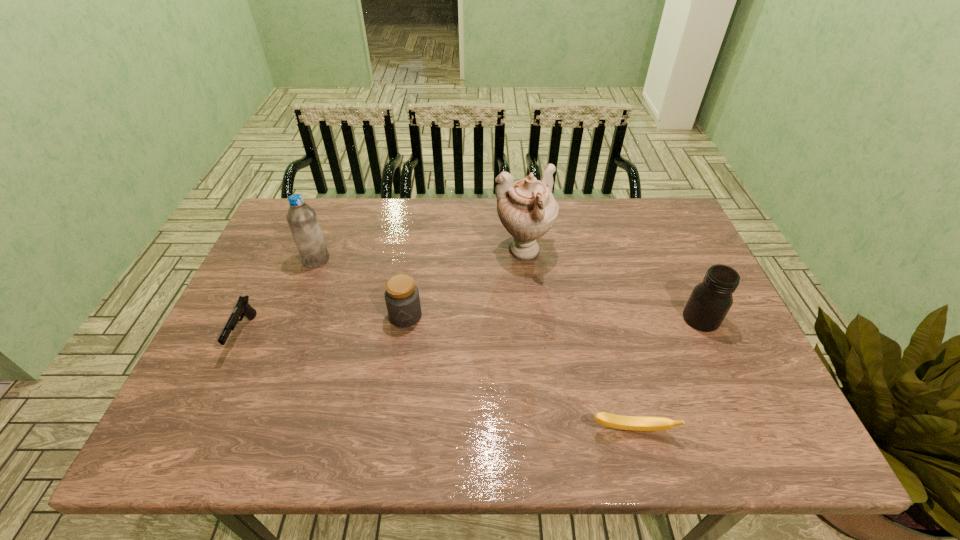
Image resolution: width=960 pixels, height=540 pixels. I want to click on vacant region between the second tallest object and the third tallest object, so point(509,289).

Find the location of `vacant point located between the leftmost object and the fourth shortest object`. vacant point located between the leftmost object and the fourth shortest object is located at coordinates (472, 326).

Locate an element on the screen. This screenshot has width=960, height=540. vacant region between the fourth object from left to right and the fourth tallest object is located at coordinates (465, 284).

The image size is (960, 540). I want to click on blank region between the left jar and the third object from right to left, so click(x=465, y=284).

The width and height of the screenshot is (960, 540). What are the coordinates of `free space that is in between the shorter jar and the leftmost object` in the screenshot? It's located at (325, 325).

In order to click on vacant point located between the gun and the second object from left to right in this screenshot , I will do `click(280, 296)`.

Locate an element on the screen. This screenshot has width=960, height=540. vacant area that lies between the fifth object from left to right and the second shortest object is located at coordinates (438, 382).

Identify the location of vacant point located between the banana and the leftmost object. (438, 382).

Locate an element on the screen. the second closest object relative to the left jar is located at coordinates (302, 220).

Identify which object is the fourth closest to the fourth shortest object. Please provide its 2D coordinates. Your answer should be formatted as a tuple, i.e. [(x, y)], where the tuple contains the x and y coordinates of a point satisfying the conditions above.

[(302, 220)]